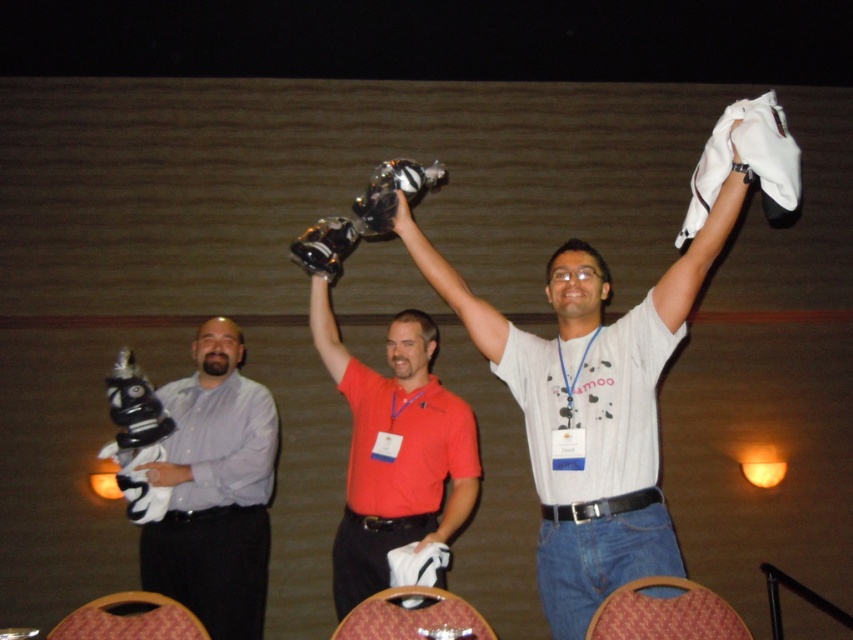
Does brushed metal trophy at left have a lesser height compared to wooden chair at lower left?

No.

What do you see at coordinates (213, 490) in the screenshot?
I see `brushed metal trophy at left` at bounding box center [213, 490].

Measure the distance between brushed metal trophy at left and camera.

A distance of 10.85 feet exists between brushed metal trophy at left and camera.

Image resolution: width=853 pixels, height=640 pixels. In order to click on brushed metal trophy at left in this screenshot , I will do `click(213, 490)`.

Is point (538, 365) closer to camera compared to point (375, 609)?

No, (538, 365) is further to viewer.

I want to click on white matte t-shirt at center, so click(x=612, y=372).

This screenshot has width=853, height=640. What are the coordinates of `white matte t-shirt at center` in the screenshot? It's located at (612, 372).

Which of these two, red matte shirt at center or wooden textured chair at lower center, stands taller?

red matte shirt at center

Can you confirm if red matte shirt at center is taller than wooden textured chair at lower center?

Indeed, red matte shirt at center has a greater height compared to wooden textured chair at lower center.

Does point (343, 388) come behind point (630, 582)?

Yes.

Locate an element on the screen. This screenshot has width=853, height=640. red matte shirt at center is located at coordinates (395, 452).